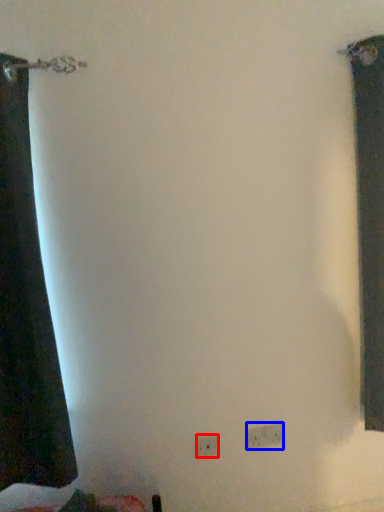
Question: Which object is further to the camera taking this photo, electric outlet (highlighted by a red box) or electric outlet (highlighted by a blue box)?

Choices:
 (A) electric outlet
 (B) electric outlet

Answer: (B)